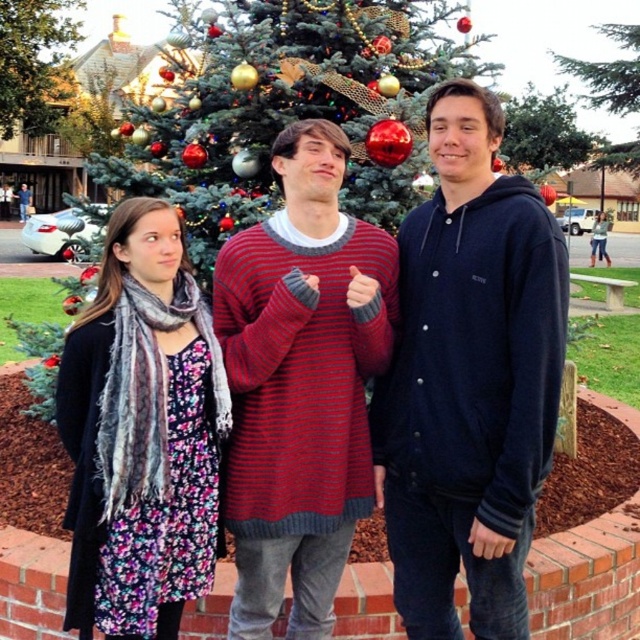
You are a photographer trying to capture a photo of the striped knit sweater at center and the decorated christmas tree at center. Based on their positions, which object should you focus on first if you want to ensure both are in sharp focus?

The striped knit sweater at center is below the decorated christmas tree at center, so you should focus on the decorated christmas tree at center first to ensure both are in sharp focus.

You are a photographer trying to capture a group photo of the floral dress at center and the green textured pine tree at upper center. Which object should you focus on first if you want to ensure both are in sharp focus, considering their sizes?

The floral dress at center is thinner than the green textured pine tree at upper center, so you should focus on the green textured pine tree at upper center first since it is larger and requires more precise focus to ensure sharpness.

You are standing at point (35, 109) and want to walk to the Christmas tree. There is a point at (493, 285) in your path. Is this point in front of or behind you relative to your direction of travel?

The point at (493, 285) is in front of point (35, 109), so it is in front of you on your path to the Christmas tree.